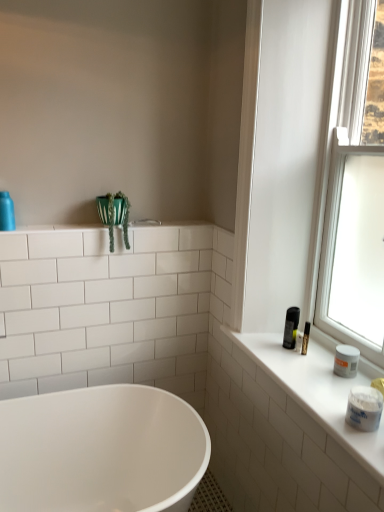
Identify the location of free space that is to the left of transparent glass window at upper right. (299, 351).